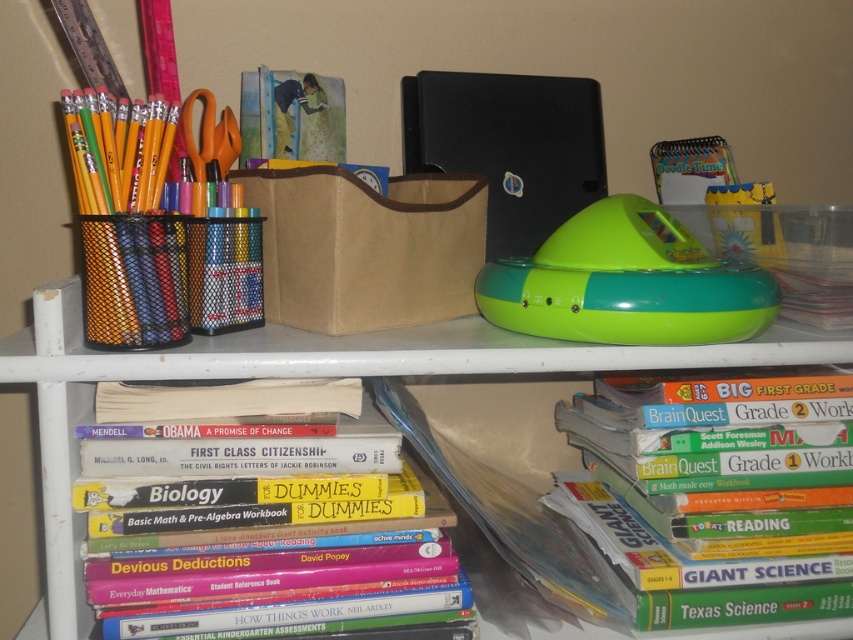
You are organizing the top shelf and want to place a new item between the green plastic speaker at upper center and the green matte book at lower right. Considering their heights, which item should be placed on the bottom to avoid blocking the view of the taller one?

The green plastic speaker at upper center is taller than the green matte book at lower right. To avoid blocking the view of the taller item, place the green matte book at lower right on the bottom.

You are a student trying to organize your desk. You have two points on your desk labeled as point (775, 358) and point (665, 310). Which point is closer to you?

Point (775, 358) is further to the camera than point (665, 310), so point (665, 310) is closer to you.

You are organizing the shelf and want to place the green plastic speaker at upper center and the green matte book at lower right. Based on their current positions, which object is located higher on the shelf?

The green plastic speaker at upper center is located higher on the shelf than the green matte book at lower right.